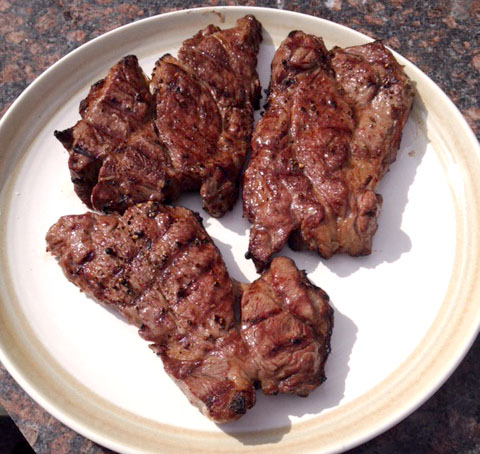
Identify the location of table. The height and width of the screenshot is (454, 480). (38, 20), (452, 32), (36, 431).